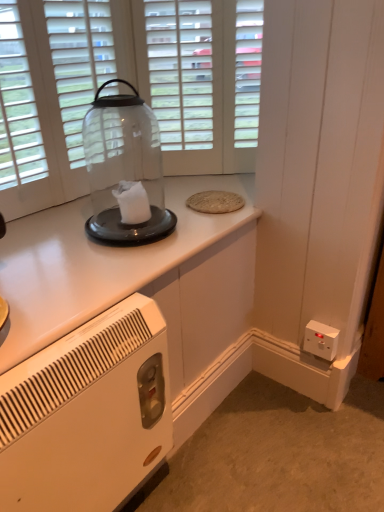
Where is `vacant space in front of transparent glass jar at center`? The image size is (384, 512). vacant space in front of transparent glass jar at center is located at coordinates (105, 263).